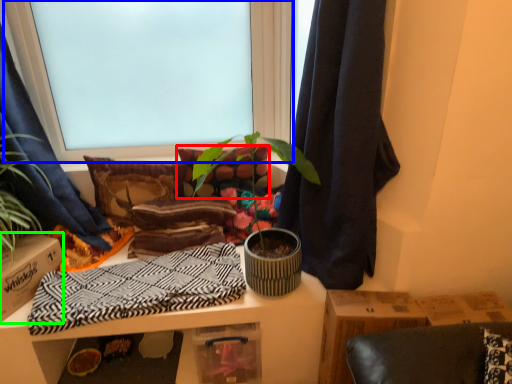
Question: Which object is positioned closest to pillow (highlighted by a red box)? Select from window (highlighted by a blue box) and cardboard box (highlighted by a green box).

Choices:
 (A) window
 (B) cardboard box

Answer: (A)